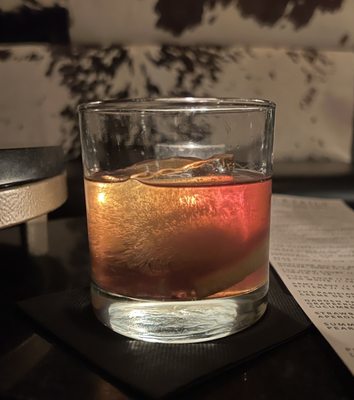
At what (x,y) coordinates should I click in order to perform the action: click on bottom of glass. Please return your answer as a coordinate pair (x, y). Image resolution: width=354 pixels, height=400 pixels. Looking at the image, I should click on (192, 339).